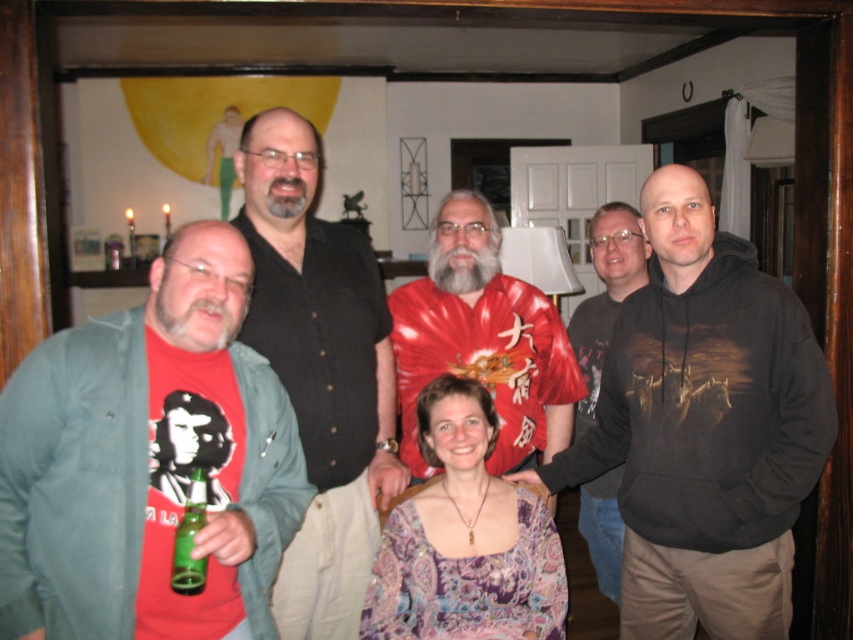
Question: Which point is closer to the camera taking this photo?

Choices:
 (A) (410, 298)
 (B) (375, 506)
 (C) (149, 436)
 (D) (749, 595)

Answer: (C)

Question: Which object appears farthest from the camera in this image?

Choices:
 (A) matte red t-shirt at left
 (B) dark gray hoodie at right

Answer: (B)

Question: Does dark brown hoodie at right have a smaller size compared to green glass bottle at lower left?

Choices:
 (A) no
 (B) yes

Answer: (A)

Question: Does dark gray hoodie at right have a lesser width compared to dark brown hoodie at right?

Choices:
 (A) yes
 (B) no

Answer: (B)

Question: Estimate the real-world distances between objects in this image. Which object is closer to the green glass bottle at lower left?

Choices:
 (A) matte red t-shirt at left
 (B) shiny red shirt at center
 (C) dark gray hoodie at right

Answer: (A)

Question: Does paisley fabric blouse at center have a lesser width compared to dark brown hoodie at right?

Choices:
 (A) yes
 (B) no

Answer: (B)